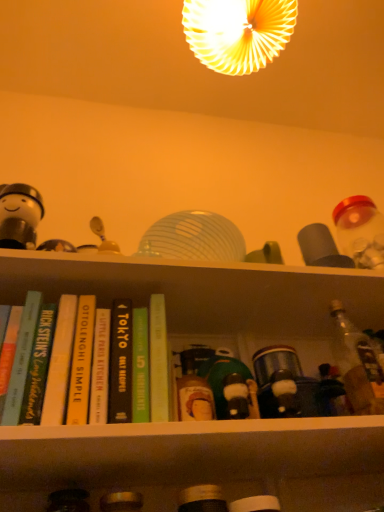
Locate an element on the screen. This screenshot has width=384, height=512. unoccupied space behind clear glass bottle at right, the 3th bottle positioned from the left is located at coordinates (356, 454).